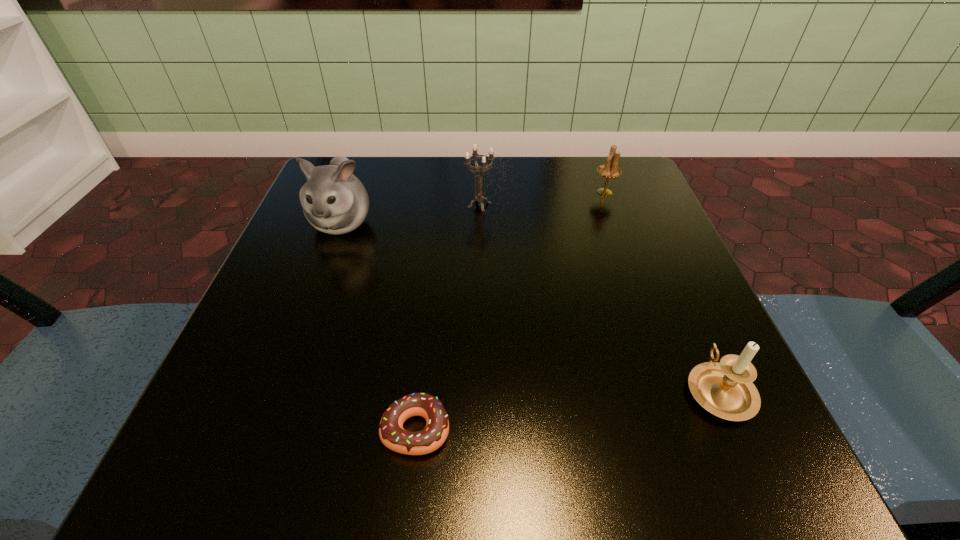
Where is `vacant space located with a handle on the side of the nearest candle holder`? This screenshot has width=960, height=540. vacant space located with a handle on the side of the nearest candle holder is located at coordinates (678, 298).

Where is `vacant space positioned on the back of the shortest object`? vacant space positioned on the back of the shortest object is located at coordinates (436, 247).

Find the location of a particular element. hamster situated at the far edge is located at coordinates (334, 201).

I want to click on candle holder that is positioned at the near edge, so click(725, 389).

Find the location of a particular element. This screenshot has height=540, width=960. doughnut at the near edge is located at coordinates (392, 434).

Identify the location of object located in the left edge section of the desktop. Image resolution: width=960 pixels, height=540 pixels. (334, 201).

The height and width of the screenshot is (540, 960). Find the location of `object that is at the far left corner`. object that is at the far left corner is located at coordinates (334, 201).

This screenshot has height=540, width=960. In order to click on object present at the far right corner in this screenshot , I will do `click(610, 170)`.

The height and width of the screenshot is (540, 960). What are the coordinates of `object located in the near right corner section of the desktop` in the screenshot? It's located at (725, 389).

What are the coordinates of `free space at the far edge of the desktop` in the screenshot? It's located at (491, 170).